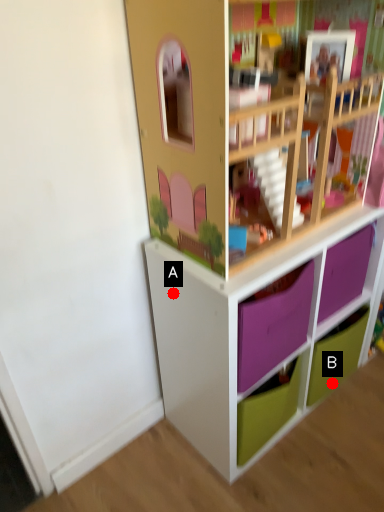
Question: Two points are circled on the image, labeled by A and B beside each circle. Which point is closer to the camera?

Choices:
 (A) A is closer
 (B) B is closer

Answer: (A)